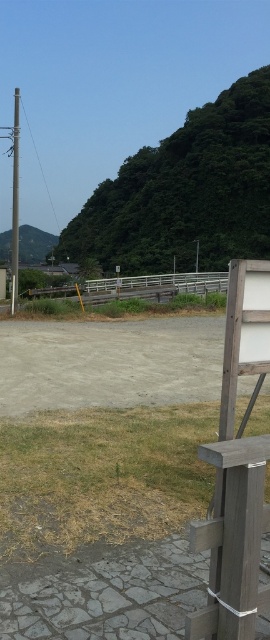
Who is more forward, (264, 464) or (18, 88)?

Point (264, 464)

Does wooden bench at lower right have a larger size compared to metallic gray pole at left?

No, wooden bench at lower right is not bigger than metallic gray pole at left.

Which is in front, point (241, 522) or point (14, 243)?

Point (241, 522) is in front.

Image resolution: width=270 pixels, height=640 pixels. I want to click on wooden bench at lower right, so click(234, 540).